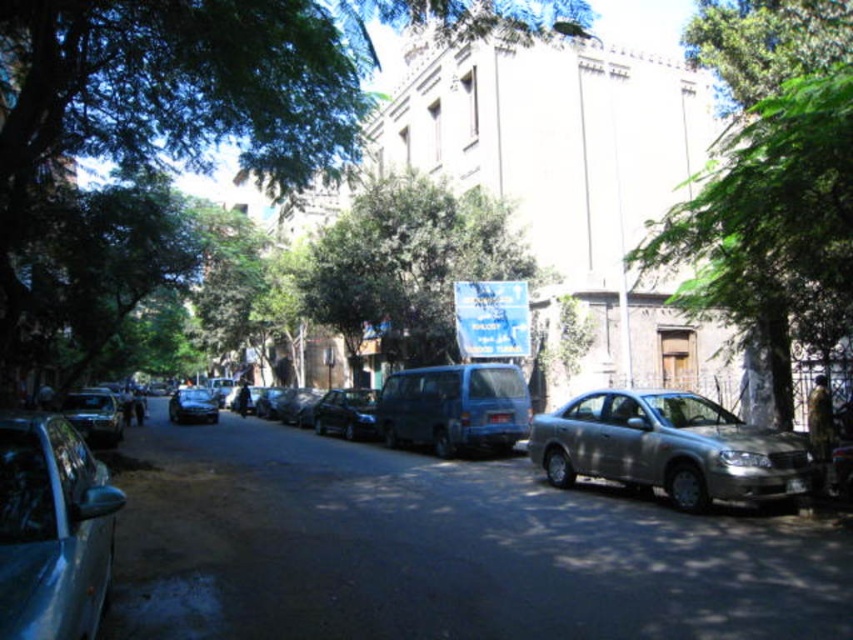
Question: Does green leafy tree at upper right lie in front of silver metallic sedan at right?

Choices:
 (A) no
 (B) yes

Answer: (A)

Question: Is green leafy tree at upper center further to the viewer compared to shiny silver car at lower left?

Choices:
 (A) yes
 (B) no

Answer: (A)

Question: Which of the following is the farthest from the observer?

Choices:
 (A) blue matte van at center
 (B) green leafy tree at upper right
 (C) shiny black sedan at center
 (D) green leafy tree at upper center

Answer: (C)

Question: Is green leafy tree at upper center bigger than shiny silver sedan at center?

Choices:
 (A) no
 (B) yes

Answer: (B)

Question: Which of these objects is positioned closest to the green leafy tree at upper right?

Choices:
 (A) green leafy tree at upper center
 (B) green leafy tree at center
 (C) shiny silver car at lower left

Answer: (C)

Question: Among these points, which one is farthest from the camera?

Choices:
 (A) (351, 317)
 (B) (761, 179)
 (C) (337, 396)
 (D) (646, 451)

Answer: (A)